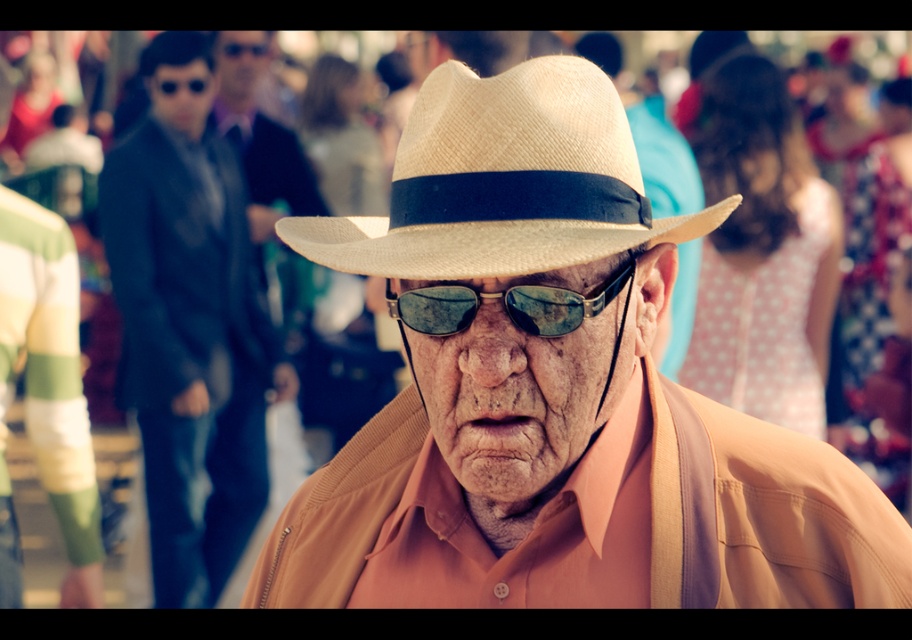
Question: Which object is positioned closest to the matte straw hat at center?

Choices:
 (A) natural straw hat at center
 (B) sunglasses at center
 (C) matte black jacket at left

Answer: (B)

Question: Can you confirm if matte straw hat at center is bigger than natural straw hat at center?

Choices:
 (A) yes
 (B) no

Answer: (A)

Question: Is matte black jacket at left bigger than sunglasses at center?

Choices:
 (A) no
 (B) yes

Answer: (B)

Question: Can you confirm if matte straw hat at center is bigger than sunglasses at center?

Choices:
 (A) no
 (B) yes

Answer: (B)

Question: Which of the following is the farthest from the observer?

Choices:
 (A) (434, 348)
 (B) (479, 292)
 (C) (423, 132)
 (D) (188, 355)

Answer: (D)

Question: Which object appears closest to the camera in this image?

Choices:
 (A) sunglasses at center
 (B) natural straw hat at center
 (C) matte straw hat at center
 (D) matte black jacket at left

Answer: (C)